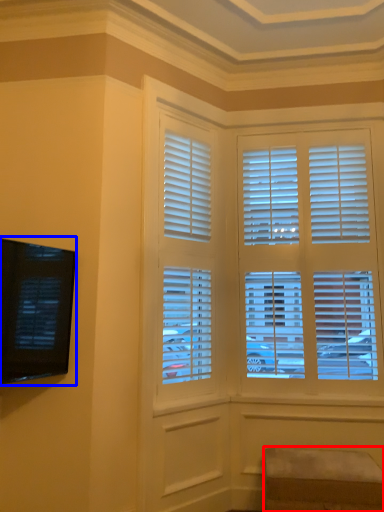
Question: Which point is further to the camera, furniture (highlighted by a red box) or window screen (highlighted by a blue box)?

Choices:
 (A) furniture
 (B) window screen

Answer: (A)